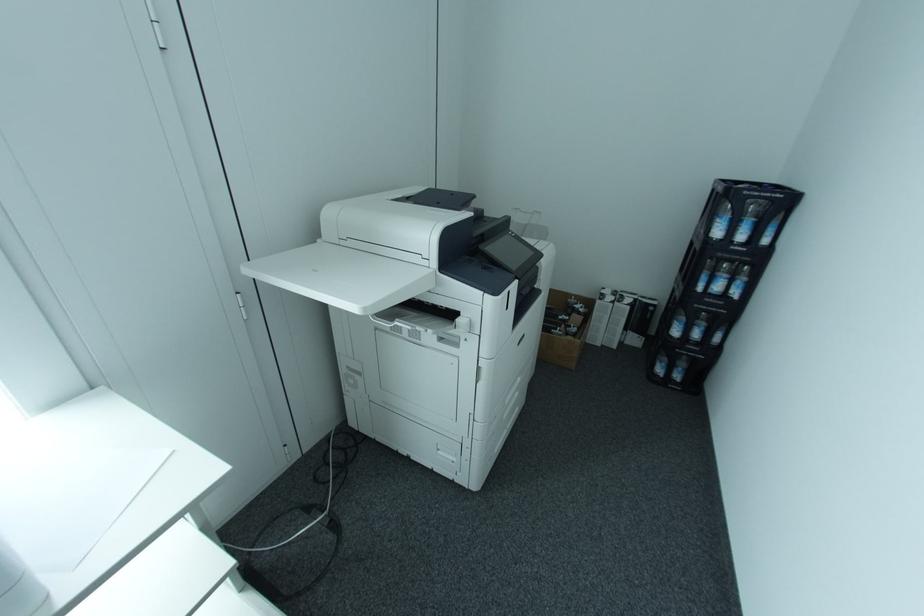
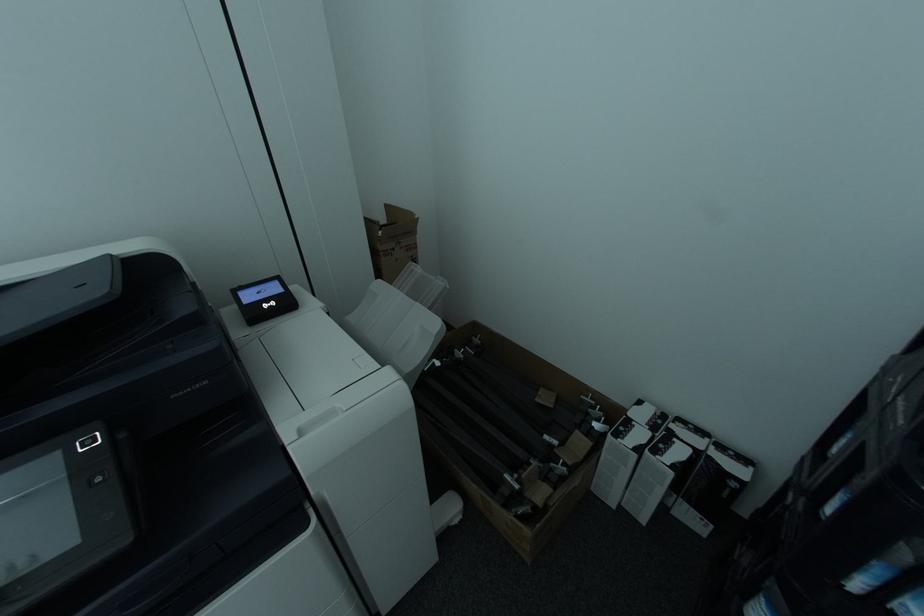
In a continuous first-person perspective shot, in which direction is the camera moving?

The movement direction of the cameraman is right, forward.